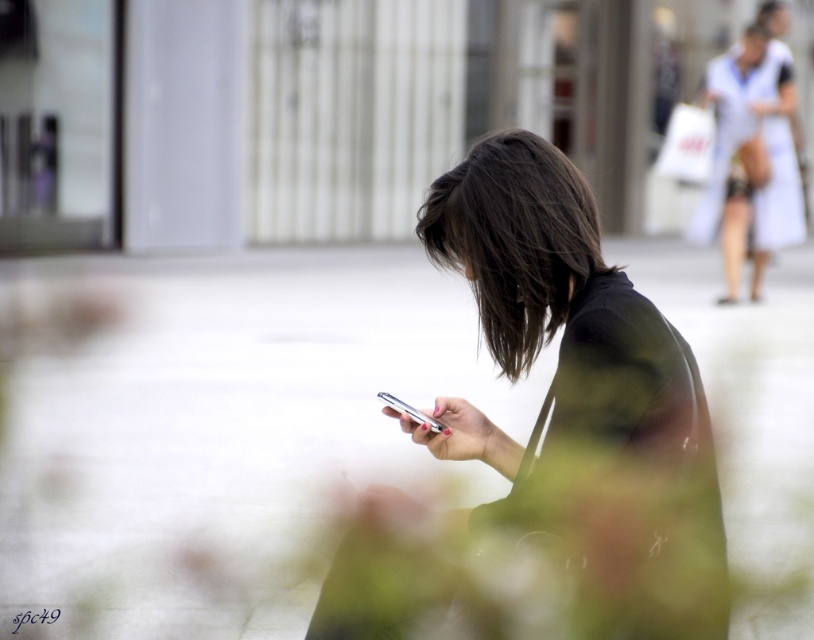
Question: Does dark brown silky hair at center appear on the right side of silver metallic smartphone at center?

Choices:
 (A) yes
 (B) no

Answer: (A)

Question: Which point is closer to the camera?

Choices:
 (A) (751, 211)
 (B) (444, 186)
 (C) (502, 410)

Answer: (B)

Question: Which point is farther to the camera?

Choices:
 (A) dark brown silky hair at center
 (B) blacksmoothtext at center
 (C) silver metallic smartphone at center
 (D) white concrete pavement at center

Answer: (B)

Question: Which point is closer to the camera?

Choices:
 (A) white cotton dress at upper right
 (B) matte black phone at center
 (C) white concrete pavement at center

Answer: (B)

Question: Is matte black phone at center bigger than white cotton dress at upper right?

Choices:
 (A) yes
 (B) no

Answer: (B)

Question: Does white concrete pavement at center lie in front of dark brown silky hair at center?

Choices:
 (A) no
 (B) yes

Answer: (A)